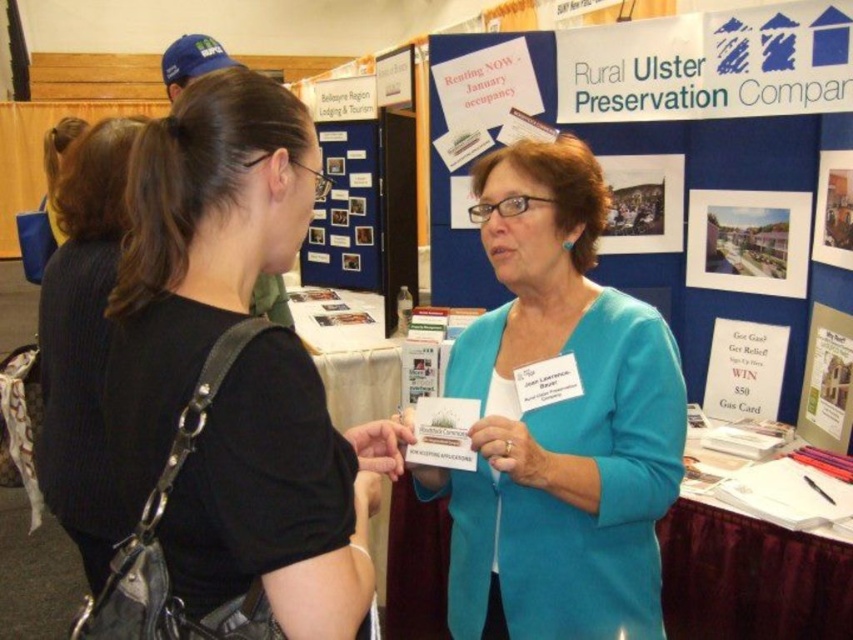
You are at the Rural Ulster Preservation Company booth and want to read both the blue fabric card at center and the matte paper poster at upper right. Which one should you look at first if you want to start with the one that is higher up?

The matte paper poster at upper right is higher up, so you should look at it first.

You are organizing a community event and need to ensure that all materials fit on the booth table. The black ribbed sweater at left and the white paper poster at upper center need to be placed side by side. Given their sizes, will there be enough space if the table is 1.2 meters wide?

The black ribbed sweater at left is wider than the white paper poster at upper center. However, without knowing the exact combined width of both items, it is impossible to determine if they will fit on a 1.2 meter table. Additional measurements are needed.

You are attending the Rural Ulster Preservation Company event and notice two items of interest. You see the black ribbed sweater at left and the white paper poster at upper center. Which item is located more to the left side of the scene?

The black ribbed sweater at left is positioned on the left side of the white paper poster at upper center, so the black ribbed sweater at left is more to the left.